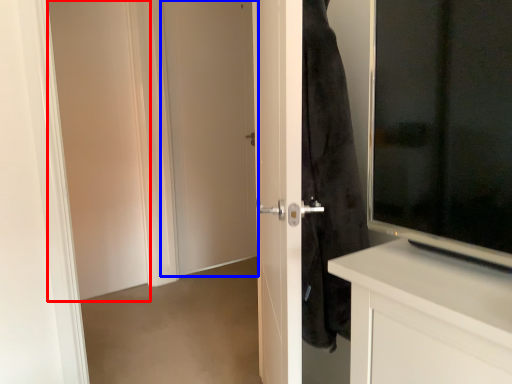
Question: Which point is closer to the camera, screen door (highlighted by a red box) or door (highlighted by a blue box)?

Choices:
 (A) screen door
 (B) door

Answer: (A)